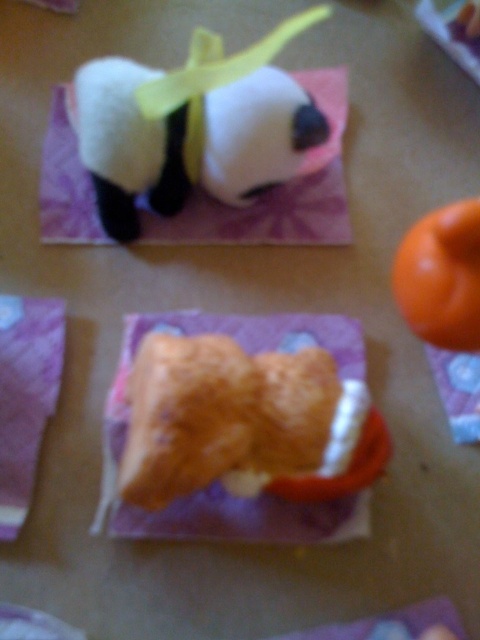
Measure the distance between white plush panda at upper left and camera.

They are 1.06 meters apart.

Does white plush panda at upper left lie behind orange matte ball at upper right?

Yes, white plush panda at upper left is behind orange matte ball at upper right.

Is point (197, 48) farther from viewer compared to point (399, 243)?

No, it is not.

Find the location of a particular element. Image resolution: width=480 pixels, height=640 pixels. white plush panda at upper left is located at coordinates coord(193,125).

Which is below, golden brown bread at center or orange matte ball at upper right?

golden brown bread at center

The height and width of the screenshot is (640, 480). Describe the element at coordinates (237, 422) in the screenshot. I see `golden brown bread at center` at that location.

Between point (168, 406) and point (434, 291), which one is positioned behind?

The point (168, 406) is behind.

Where is `golden brown bread at center`? This screenshot has width=480, height=640. golden brown bread at center is located at coordinates (237, 422).

Find the location of a particular element. Image resolution: width=480 pixels, height=640 pixels. white plush panda at upper left is located at coordinates click(193, 125).

Does white plush panda at upper left appear over golden brown bread at center?

Indeed, white plush panda at upper left is positioned over golden brown bread at center.

The width and height of the screenshot is (480, 640). Describe the element at coordinates (193, 125) in the screenshot. I see `white plush panda at upper left` at that location.

I want to click on white plush panda at upper left, so click(193, 125).